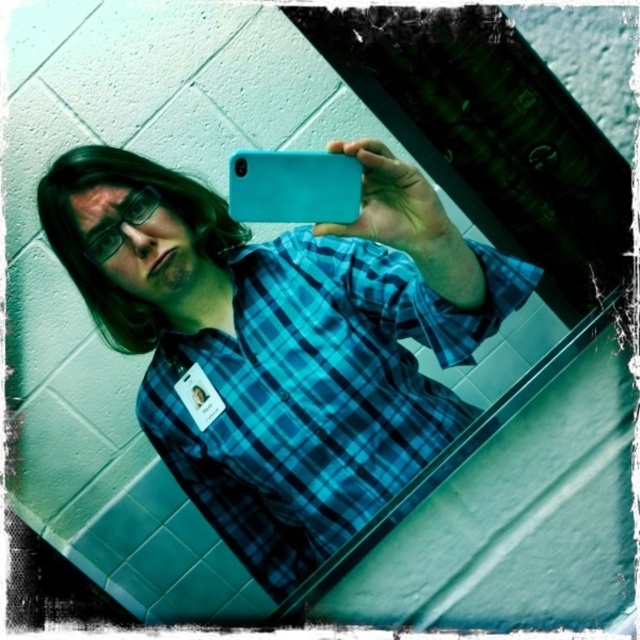
Based on the photo, you are trying to take a selfie with the blue plaid shirt at center and the teal matte phone at center. Which object will appear larger in the photo?

The blue plaid shirt at center will appear larger in the photo because it is bigger than the teal matte phone at center.